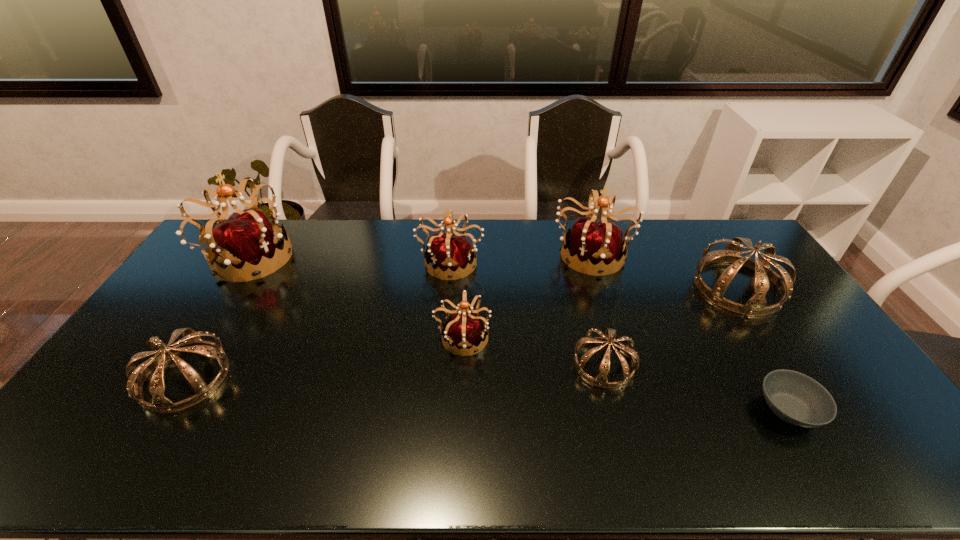
You are a GUI agent. You are given a task and a screenshot of the screen. Output one action in this format:
    pyautogui.click(x=<x>, y=<y>)
    Task: Click on the blank space located 0.050m on the back of the shortest object
    
    Given the screenshot: What is the action you would take?
    pyautogui.click(x=764, y=368)

I want to click on tiara that is positioned at the right edge, so click(x=755, y=306).

This screenshot has height=540, width=960. What are the coordinates of `soup bowl that is at the right edge` in the screenshot? It's located at (795, 398).

This screenshot has height=540, width=960. Identify the location of object at the far left corner. (245, 243).

At what (x,y) coordinates should I click in order to perform the action: click on free location at the far edge of the desktop. Please return your answer as a coordinate pair (x, y). This screenshot has height=540, width=960. Looking at the image, I should click on (306, 235).

Find the location of a particular element. The image size is (960, 540). vacant space at the near edge of the desktop is located at coordinates (506, 457).

Locate an element on the screen. vacant region at the left edge is located at coordinates (185, 310).

Where is `vacant space at the right edge of the desktop`? This screenshot has width=960, height=540. vacant space at the right edge of the desktop is located at coordinates (771, 325).

Locate an element on the screen. free region at the far right corner is located at coordinates (723, 220).

The width and height of the screenshot is (960, 540). I want to click on empty space that is in between the sixth shortest tiara and the nearest red tiara, so click(x=527, y=295).